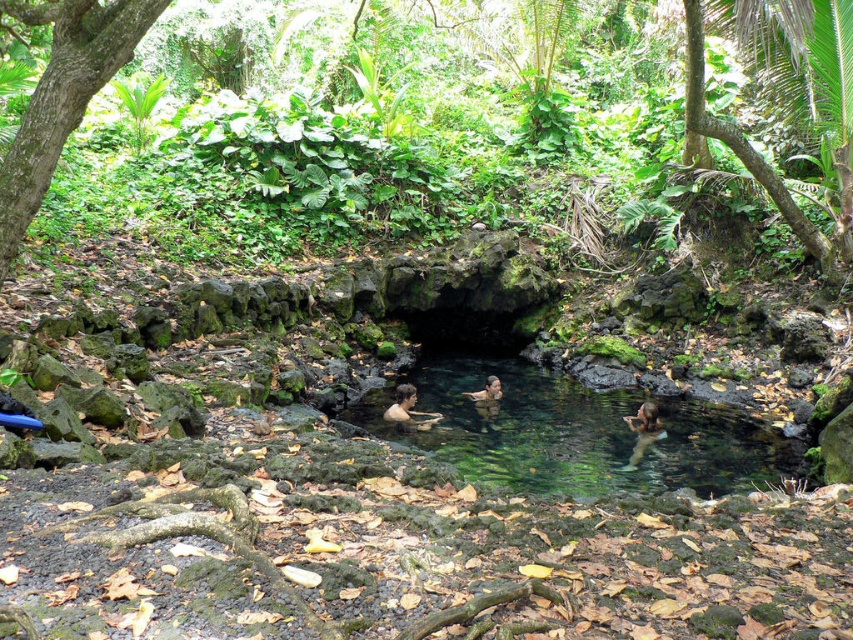
Consider the image. Can you confirm if brown skin at center is shorter than smooth skin woman at center?

In fact, brown skin at center may be taller than smooth skin woman at center.

Is brown skin at center thinner than smooth skin woman at center?

No, brown skin at center is not thinner than smooth skin woman at center.

The image size is (853, 640). Describe the element at coordinates (408, 408) in the screenshot. I see `brown skin at center` at that location.

Image resolution: width=853 pixels, height=640 pixels. I want to click on brown skin at center, so click(x=408, y=408).

Locate an element on the screen. nude skin at lower right is located at coordinates (643, 429).

Which of these two, nude skin at lower right or brown skin at center, stands taller?

With more height is nude skin at lower right.

Is point (653, 433) positioned in front of point (405, 419)?

No, (653, 433) is further to viewer.

The width and height of the screenshot is (853, 640). Find the location of `nude skin at lower right`. nude skin at lower right is located at coordinates (643, 429).

Can you confirm if green leafy vegetation at center is positioned to the right of smooth skin woman at center?

In fact, green leafy vegetation at center is to the left of smooth skin woman at center.

Between point (355, 168) and point (492, 390), which one is positioned in front?

Point (492, 390) is more forward.

Which is in front, point (372, 104) or point (495, 381)?

Point (495, 381) is in front.

Find the location of a particular element. green leafy vegetation at center is located at coordinates [438, 112].